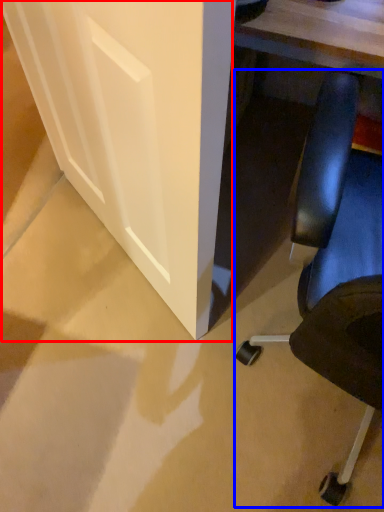
Question: Which object appears closest to the camera in this image, glass door (highlighted by a red box) or chair (highlighted by a blue box)?

Choices:
 (A) glass door
 (B) chair

Answer: (B)